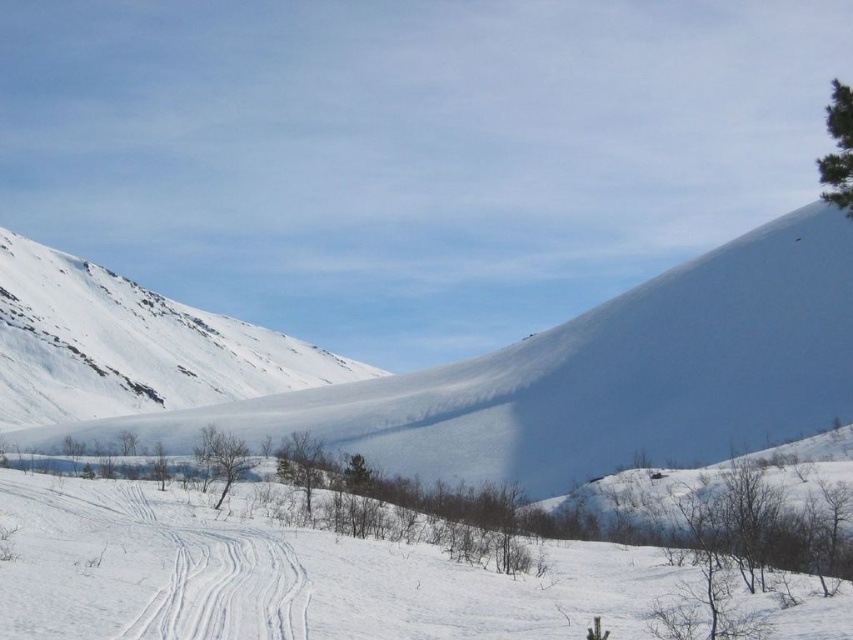
Between white snow-covered mountain at left and white snow ski slope at lower center, which one appears on the right side from the viewer's perspective?

Positioned to the right is white snow-covered mountain at left.

Which of these two, white snow-covered mountain at left or white snow ski slope at lower center, stands shorter?

white snow ski slope at lower center is shorter.

Between point (440, 470) and point (201, 618), which one is positioned behind?

Point (440, 470)

Find the location of a particular element. white snow-covered mountain at left is located at coordinates (590, 378).